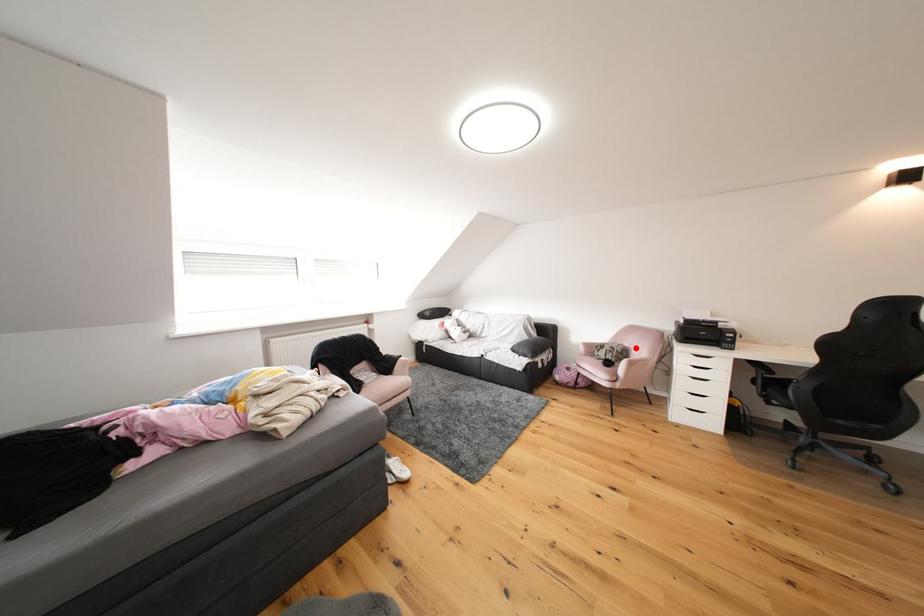
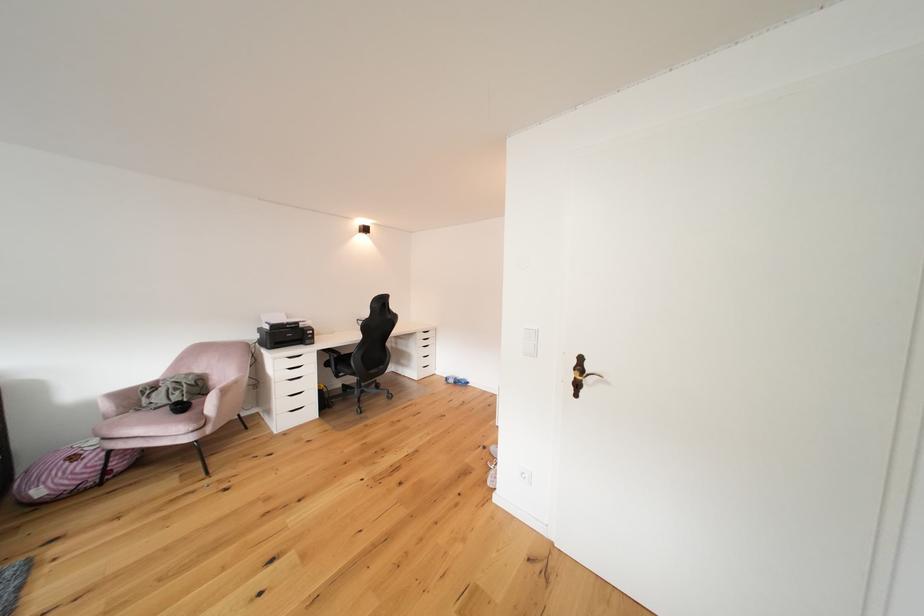
Question: I am providing you with two images of the same scene from different viewpoints. Image1 has a red point marked. In image2, the corresponding 3D location appears at what relative position? Reply with the corresponding letter.

Choices:
 (A) Closer
 (B) Farther

Answer: (A)